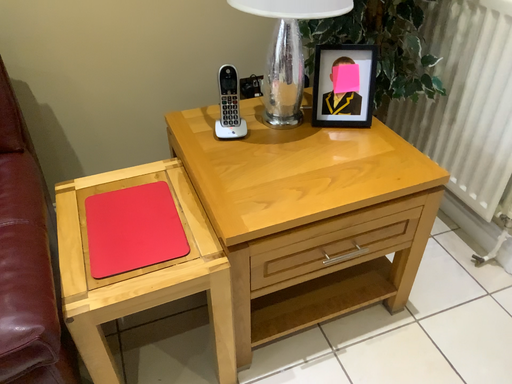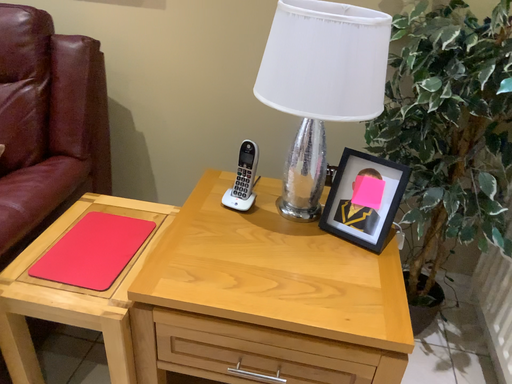
Question: Which way did the camera rotate in the video?

Choices:
 (A) rotated upward
 (B) rotated downward

Answer: (A)